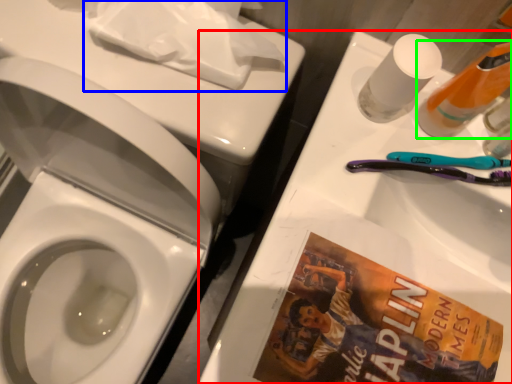
Question: Based on their relative distances, which object is farther from porcelain (highlighted by a red box)? Choose from toilet paper (highlighted by a blue box) and cleaning product (highlighted by a green box).

Choices:
 (A) toilet paper
 (B) cleaning product

Answer: (A)